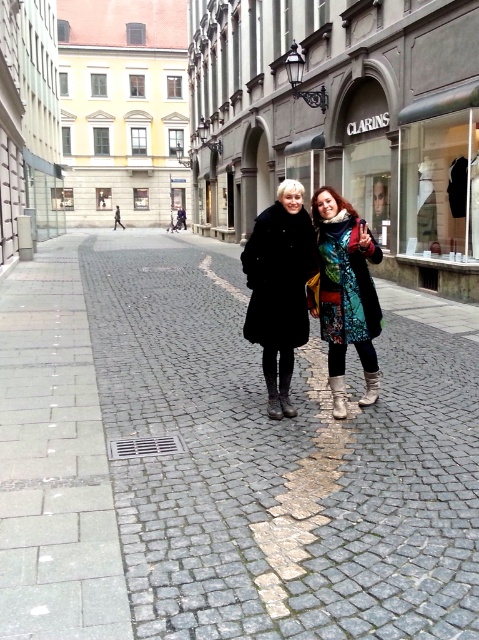
Question: Based on their relative distances, which object is farther from the matte black coat at center?

Choices:
 (A) multicolored patchwork coat at center
 (B) gray cobblestone pavement at center

Answer: (B)

Question: Is gray cobblestone pavement at center wider than matte black coat at center?

Choices:
 (A) no
 (B) yes

Answer: (B)

Question: Does gray cobblestone pavement at center appear on the left side of multicolored patchwork coat at center?

Choices:
 (A) yes
 (B) no

Answer: (A)

Question: Which point is closer to the camera taking this photo?

Choices:
 (A) (343, 227)
 (B) (304, 275)
 (C) (412, 372)

Answer: (A)

Question: Among these points, which one is farthest from the camera?

Choices:
 (A) (341, 353)
 (B) (296, 588)
 (C) (306, 221)

Answer: (A)

Question: Does matte black coat at center have a greater width compared to multicolored patchwork coat at center?

Choices:
 (A) yes
 (B) no

Answer: (B)